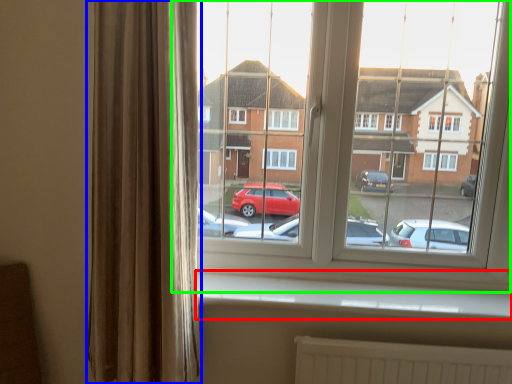
Question: Estimate the real-world distances between objects in this image. Which object is closer to window sill (highlighted by a red box), curtain (highlighted by a blue box) or window (highlighted by a green box)?

Choices:
 (A) curtain
 (B) window

Answer: (B)